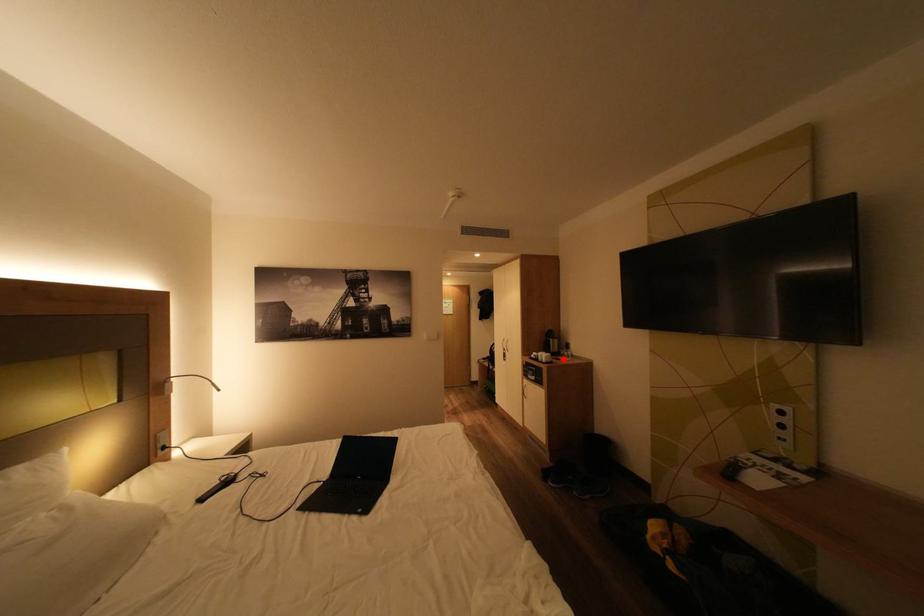
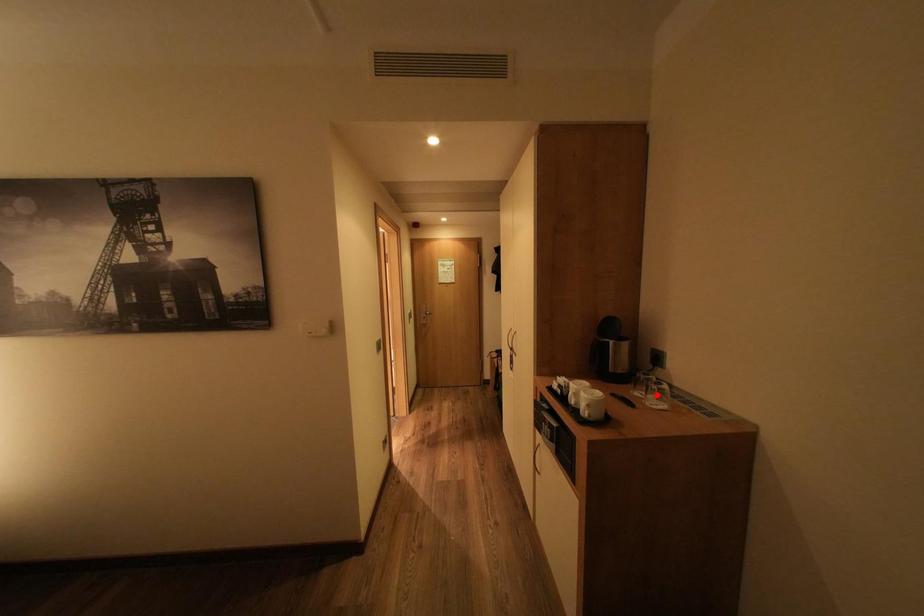
I am providing you with two images of the same scene from different viewpoints. A red point is marked on the first image and another point is marked on the second image. Is the red point in image1 aligned with the point shown in image2?

No